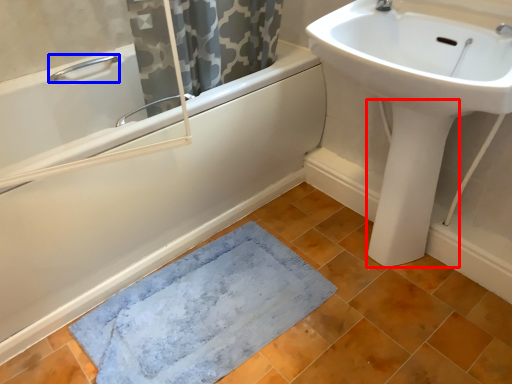
Question: Which object appears farthest to the camera in this image, bidet (highlighted by a red box) or plumbing fixture (highlighted by a blue box)?

Choices:
 (A) bidet
 (B) plumbing fixture

Answer: (B)